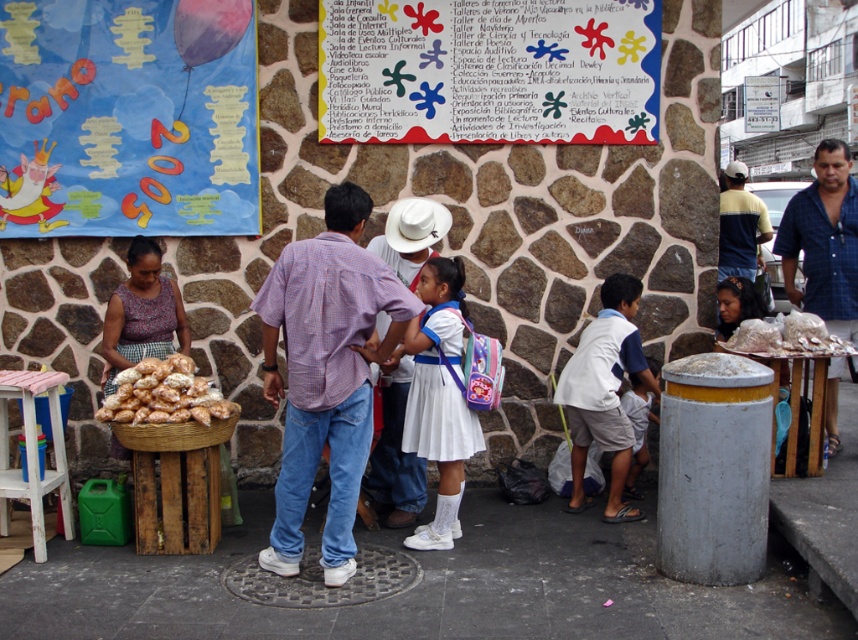
Question: Among these objects, which one is farthest from the camera?

Choices:
 (A) plaid cotton shirt at center
 (B) white paper with colorful paint splatters at upper center
 (C) yellow striped shirt at upper right
 (D) white felt cowboy hat at center

Answer: (C)

Question: Which point is farther to the camera?

Choices:
 (A) plaid cotton shirt at center
 (B) printed fabric skirt at lower left
 (C) matte purple shirt at center
 (D) golden brown bread at center

Answer: (B)

Question: Does white cotton shirt at center have a smaller size compared to blue denim shirt at center?

Choices:
 (A) yes
 (B) no

Answer: (B)

Question: Can you confirm if white paper with colorful paint splatters at upper center is positioned above plaid cotton shirt at center?

Choices:
 (A) yes
 (B) no

Answer: (A)

Question: Which object is the closest to the blue denim shirt at center?

Choices:
 (A) matte purple shirt at center
 (B) yellow striped shirt at upper right
 (C) printed fabric skirt at lower left

Answer: (B)

Question: Is white paper with colorful paint splatters at upper center wider than brown woven basket at lower left?

Choices:
 (A) yes
 (B) no

Answer: (A)